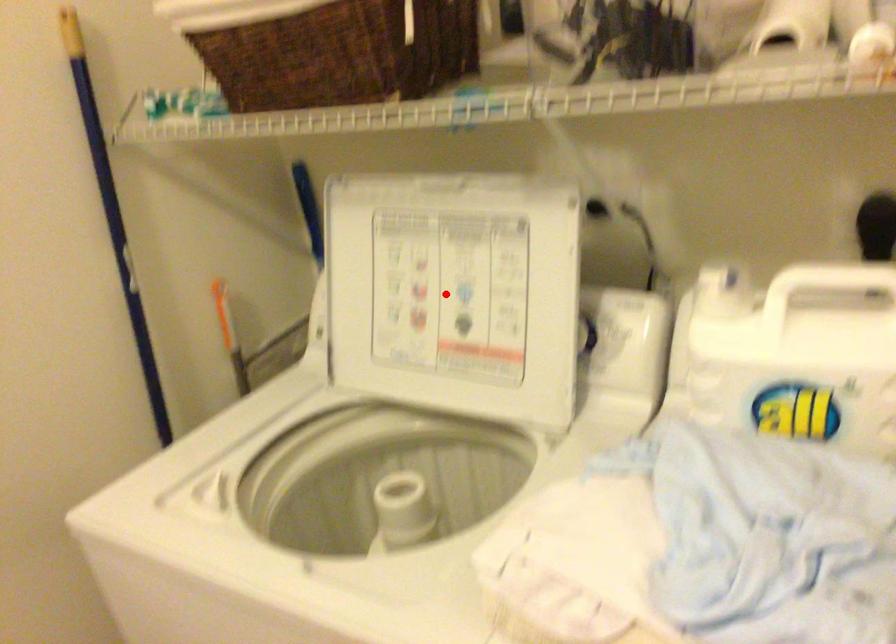
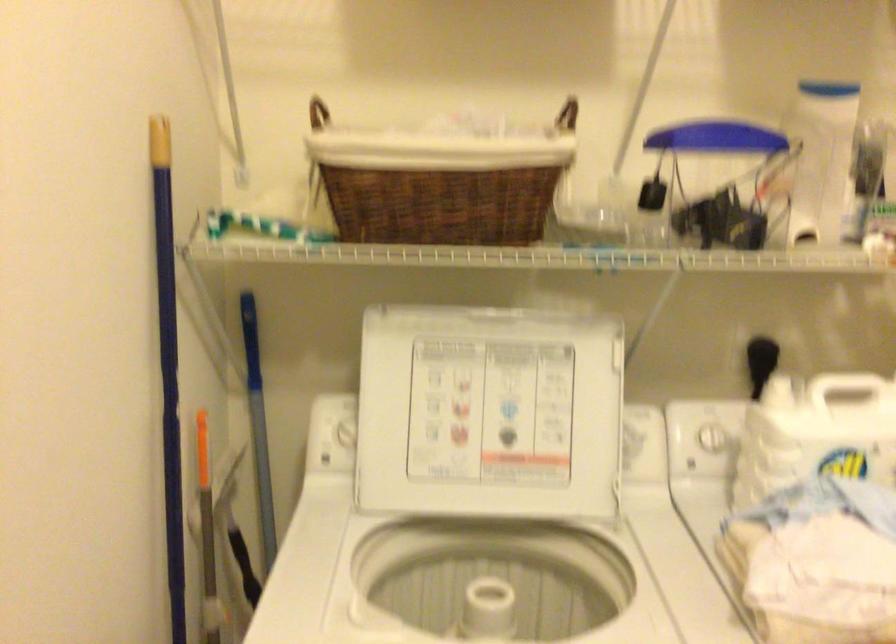
In the second image, find the point that corresponds to the highlighted location in the first image.

(488, 413)